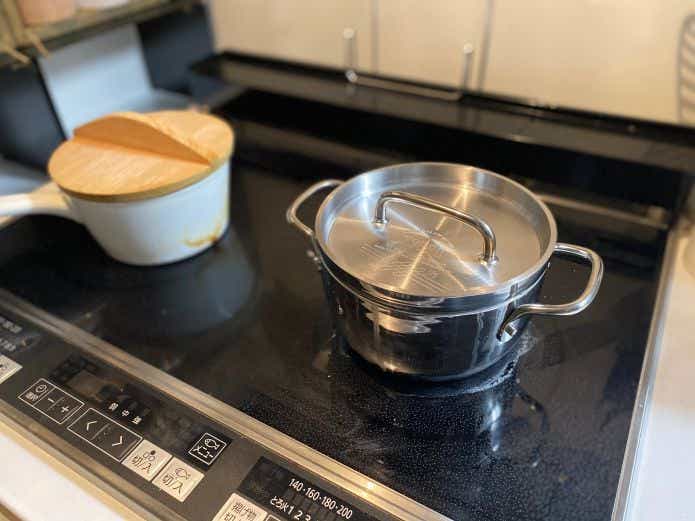
Locate an element on the screen. buttons for the stove is located at coordinates [145, 458].